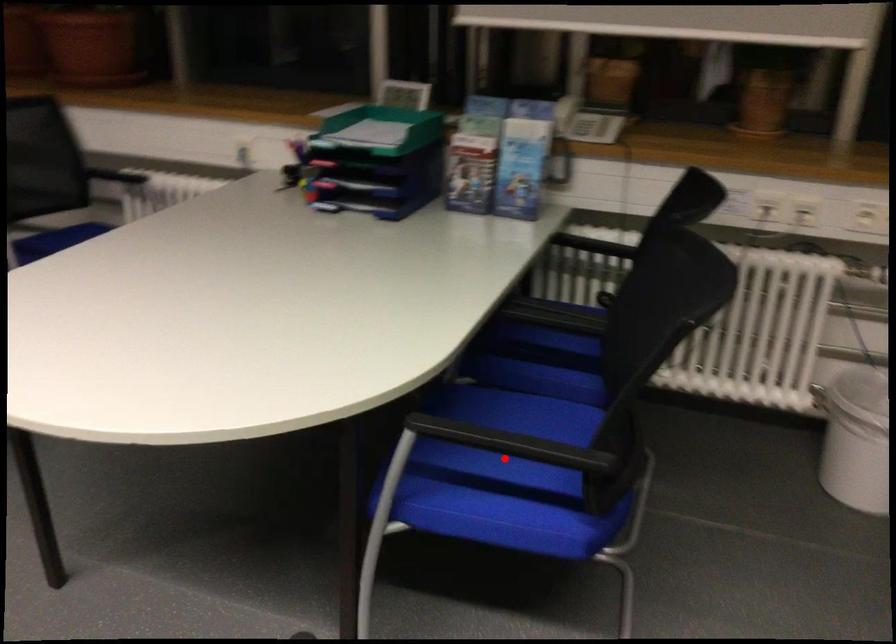
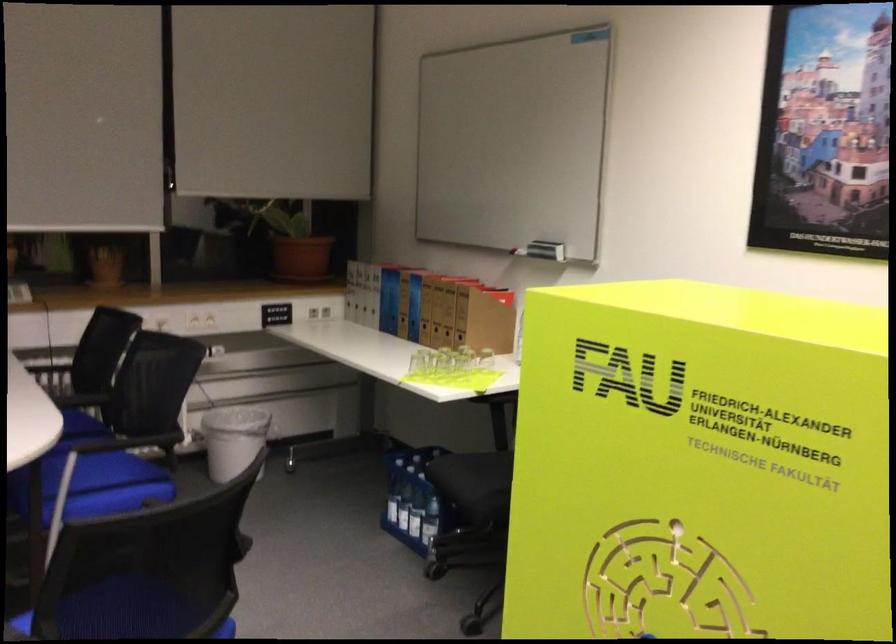
Question: I am providing you with two images of the same scene from different viewpoints. Image1 has a red point marked. In image2, the corresponding 3D location appears at what relative position? Reply with the corresponding letter.

Choices:
 (A) Closer
 (B) Farther

Answer: (B)